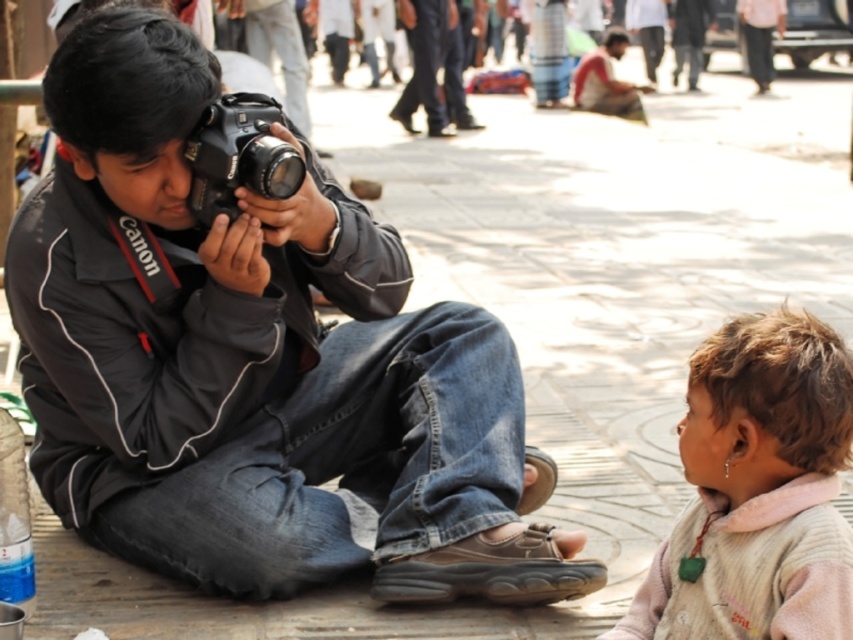
Question: Which object is the farthest from the black matte camera at center?

Choices:
 (A) dark blue jeans at center
 (B) light brown hair at lower right
 (C) black plastic camera at left

Answer: (A)

Question: Does black matte camera at center appear over black plastic camera at left?

Choices:
 (A) no
 (B) yes

Answer: (A)

Question: Where is light brown hair at lower right located in relation to black plastic camera at left in the image?

Choices:
 (A) left
 (B) right

Answer: (B)

Question: Can you confirm if black matte camera at center is wider than black plastic camera at left?

Choices:
 (A) no
 (B) yes

Answer: (B)

Question: Estimate the real-world distances between objects in this image. Which object is closer to the black matte camera at center?

Choices:
 (A) light brown hair at lower right
 (B) dark blue jeans at center
 (C) black plastic camera at left

Answer: (C)

Question: Which of these objects is positioned closest to the black plastic camera at left?

Choices:
 (A) black matte camera at center
 (B) light brown hair at lower right

Answer: (A)